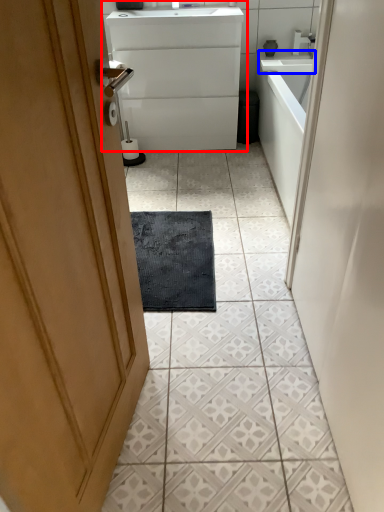
Question: Among these objects, which one is nearest to the camera, bathroom cabinet (highlighted by a red box) or counter top (highlighted by a blue box)?

Choices:
 (A) bathroom cabinet
 (B) counter top

Answer: (A)